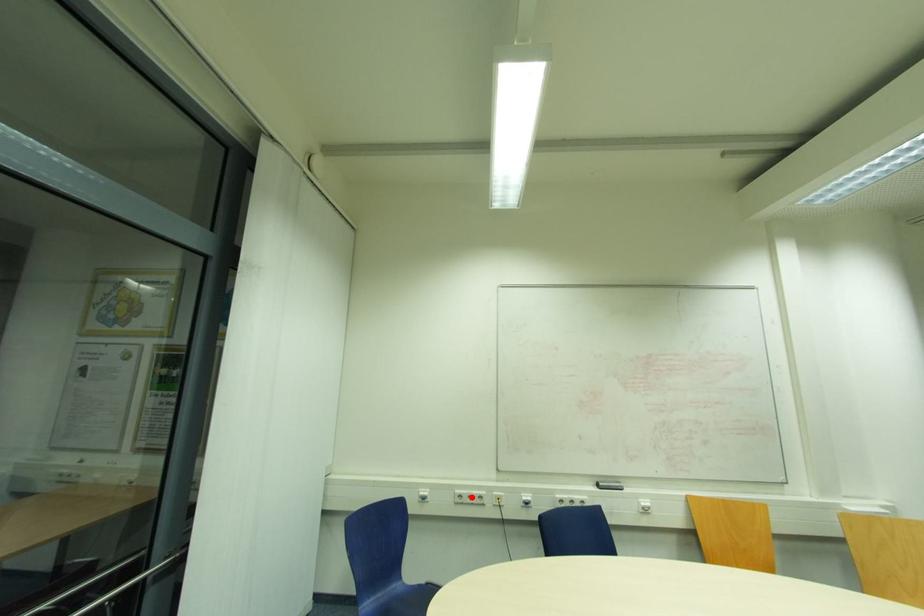
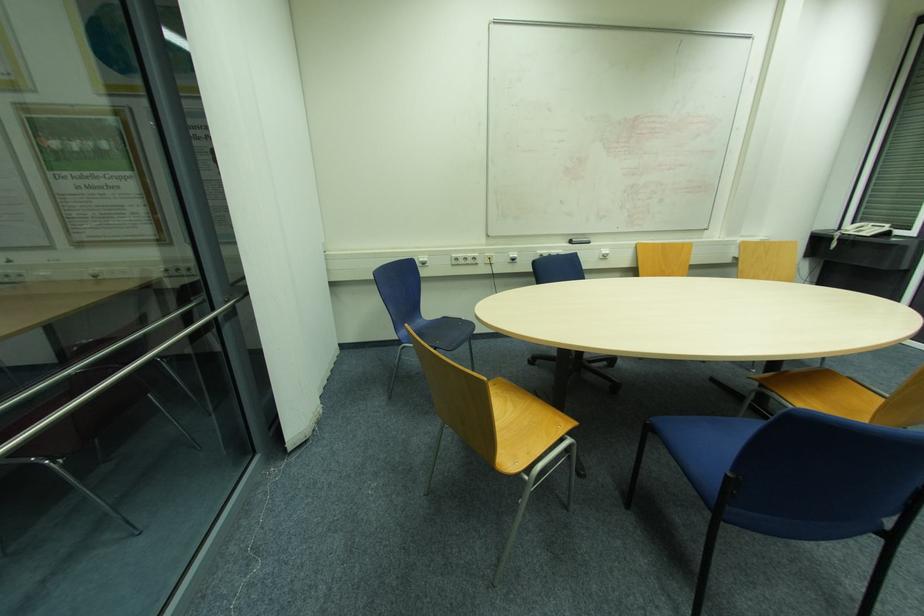
Question: A red point is marked in image1. In image2, is the corresponding 3D point closer to the camera or farther? Reply with the corresponding letter.

Choices:
 (A) The corresponding 3D point is closer.
 (B) The corresponding 3D point is farther.

Answer: (A)